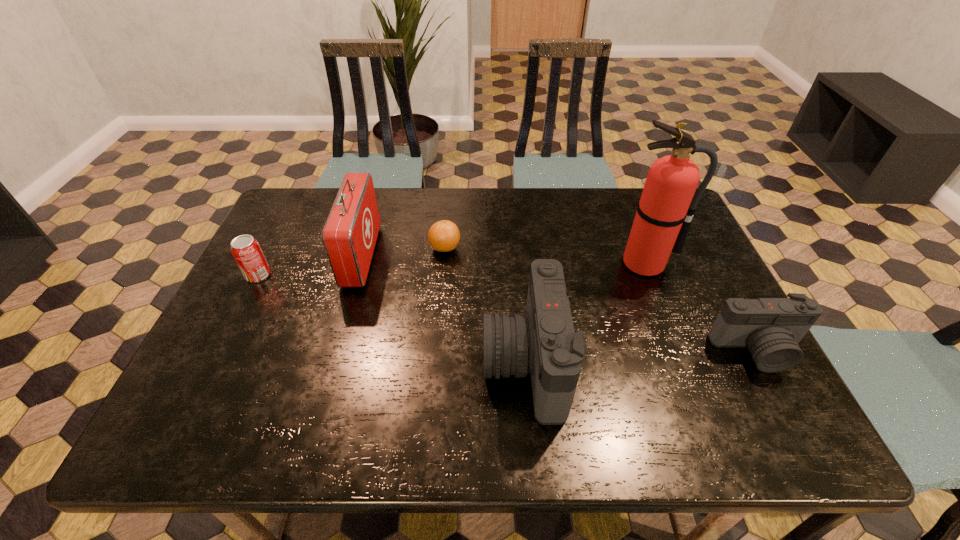
Find the location of a particular element. The height and width of the screenshot is (540, 960). vacant space located at the lens of the fourth object from left to right is located at coordinates (421, 363).

Find the location of a particular element. The width and height of the screenshot is (960, 540). vacant area located at the lens of the fourth object from left to right is located at coordinates (444, 363).

Find the location of a particular element. free space located 0.050m at the lens of the right camera is located at coordinates (780, 394).

Find the location of a particular element. The width and height of the screenshot is (960, 540). free space located on the left of the orange is located at coordinates (408, 248).

The width and height of the screenshot is (960, 540). In order to click on free spot located on the side of the first-aid kit with the first aid cross symbol in this screenshot , I will do `click(427, 256)`.

Locate an element on the screen. Image resolution: width=960 pixels, height=540 pixels. vacant space located at the nozzle of the fire extinguisher is located at coordinates (666, 319).

You are a GUI agent. You are given a task and a screenshot of the screen. Output one action in this format:
    pyautogui.click(x=<x>, y=<y>)
    Task: Click on the free space located on the back of the soda can
    
    Given the screenshot: What is the action you would take?
    pyautogui.click(x=301, y=191)

Find the location of a particular element. object positioned at the far edge is located at coordinates (350, 233).

Where is `object located in the left edge section of the desktop`? The image size is (960, 540). object located in the left edge section of the desktop is located at coordinates (246, 250).

Locate an element on the screen. camera positioned at the right edge is located at coordinates (771, 328).